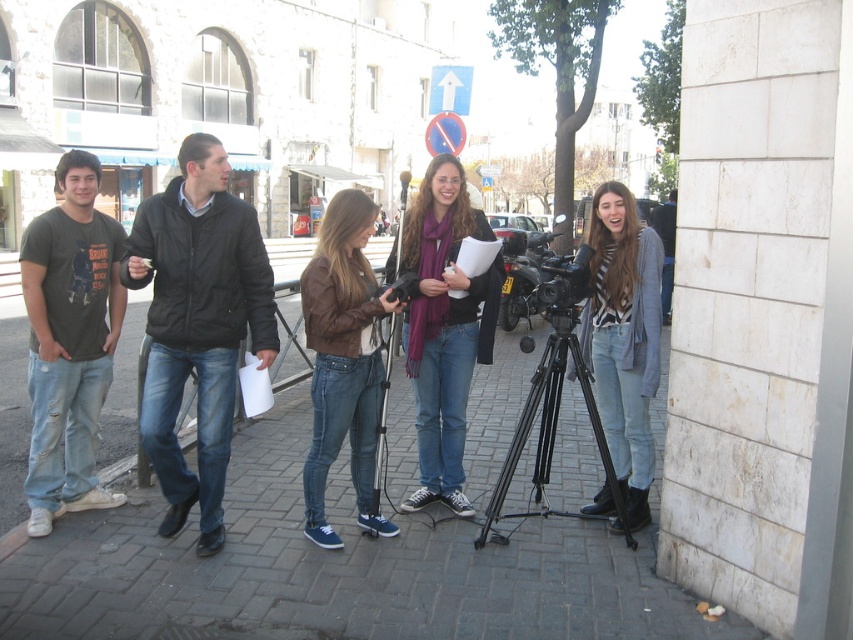
Which is below, brown leather jacket at center or dark gray jacket at center?

brown leather jacket at center is below.

Which is in front, point (358, 480) or point (666, 243)?

Point (358, 480) is more forward.

Find the location of a particular element. This screenshot has height=640, width=853. brown leather jacket at center is located at coordinates (343, 362).

Can you confirm if black metal tripod at center is thinner than black plastic video camera at center?

Correct, black metal tripod at center's width is less than black plastic video camera at center's.

Who is lower down, black metal tripod at center or black plastic video camera at center?

black metal tripod at center is below.

Between point (572, 328) and point (532, 262), which one is positioned behind?

The point (532, 262) is more distant.

I want to click on black metal tripod at center, so pyautogui.click(x=544, y=428).

Can you confirm if brick pavement at center is wider than black metal tripod at center?

Correct, the width of brick pavement at center exceeds that of black metal tripod at center.

Find the location of a particular element. brick pavement at center is located at coordinates pos(335,570).

Find the location of a particular element. brick pavement at center is located at coordinates (335, 570).